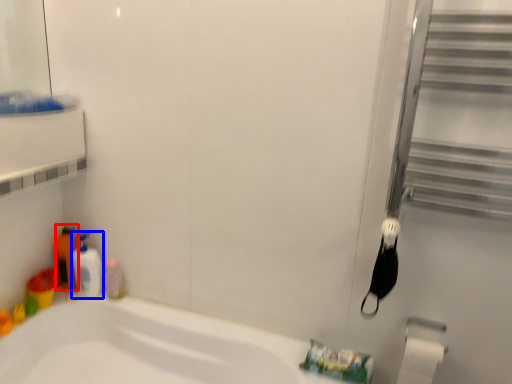
Question: Among these objects, which one is farthest to the camera, toiletry (highlighted by a red box) or cleaning product (highlighted by a blue box)?

Choices:
 (A) toiletry
 (B) cleaning product

Answer: (A)